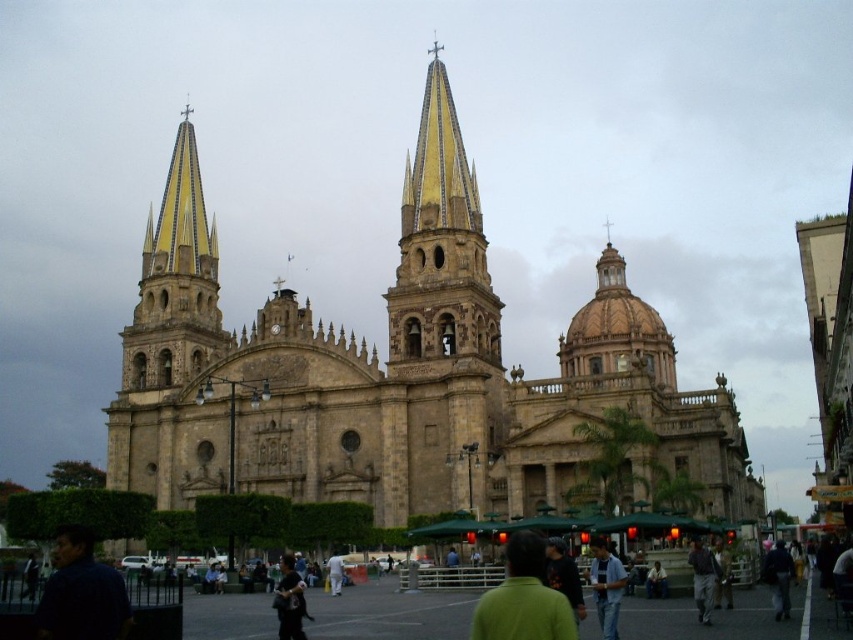
Question: Is light blue jeans at center positioned in front of dark blue jacket at center?

Choices:
 (A) no
 (B) yes

Answer: (B)

Question: Which object appears closest to the camera in this image?

Choices:
 (A) dark blue jacket at center
 (B) dark blue shirt at center
 (C) gold textured steeple at center
 (D) smooth beige stone tower at left

Answer: (B)

Question: Does dark blue shirt at lower left have a greater width compared to dark blue jacket at center?

Choices:
 (A) yes
 (B) no

Answer: (A)

Question: Is gold textured steeple at center positioned behind dark green shirt at center?

Choices:
 (A) no
 (B) yes

Answer: (B)

Question: Which object appears farthest from the camera in this image?

Choices:
 (A) gold domed dome at center
 (B) light blue jeans at center
 (C) dark green shirt at center

Answer: (A)

Question: Based on their relative distances, which object is nearer to the smooth beige stone tower at left?

Choices:
 (A) white fabric bag at center
 (B) light blue jeans at center
 (C) dark gray fabric jacket at lower right

Answer: (A)